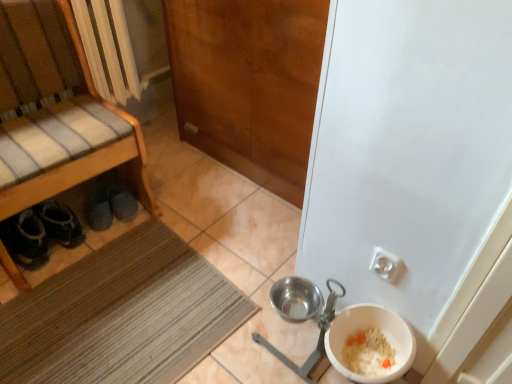
At what (x,y) coordinates should I click in order to perform the action: click on vacant space in brown textured mat at lower left (from a real-world perspective). Please return your answer as a coordinate pair (x, y). The image size is (512, 384). Looking at the image, I should click on (110, 334).